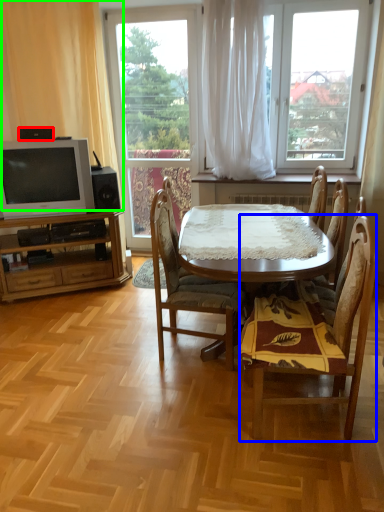
Question: Based on their relative distances, which object is farther from loudspeaker (highlighted by a red box)? Choose from chair (highlighted by a blue box) and curtain (highlighted by a green box).

Choices:
 (A) chair
 (B) curtain

Answer: (A)